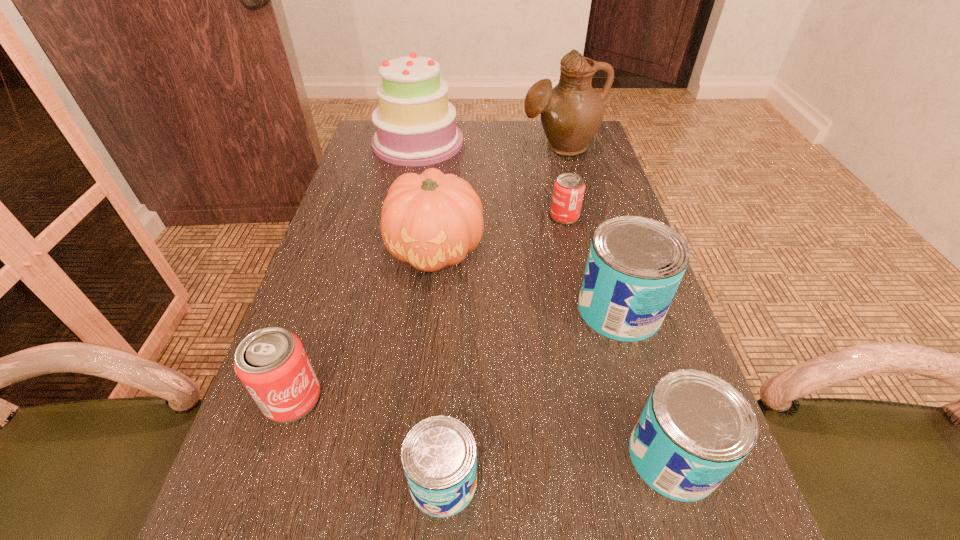
Locate an element on the screen. The image size is (960, 540). vacant point located between the cake and the brown pitcher is located at coordinates (490, 145).

The height and width of the screenshot is (540, 960). Identify the location of vacant space that is in between the leftmost can and the pitcher. (426, 273).

Locate an element on the screen. The height and width of the screenshot is (540, 960). unoccupied position between the farthest can and the pumpkin is located at coordinates (500, 233).

At what (x,y) coordinates should I click in order to perform the action: click on empty space that is in between the cake and the biggest blue can. Please return your answer as a coordinate pair (x, y). Looking at the image, I should click on (518, 226).

The width and height of the screenshot is (960, 540). I want to click on free space between the cake and the second biggest blue can, so click(x=545, y=300).

Identify the location of vacant space that is in between the second smallest blue can and the smallest blue can. The image size is (960, 540). (558, 469).

Identify the location of vacant space that is in between the pumpkin and the brown pitcher. click(x=498, y=198).

Identify the location of free space that is in between the biggest blue can and the pumpkin. This screenshot has height=540, width=960. (527, 280).

The width and height of the screenshot is (960, 540). In order to click on free space between the purple cake and the leftmost can in this screenshot , I will do `click(355, 270)`.

Identify which object is the third nearest to the tallest can. Please provide its 2D coordinates. Your answer should be formatted as a tuple, i.e. [(x, y)], where the tuple contains the x and y coordinates of a point satisfying the conditions above.

[(568, 193)]